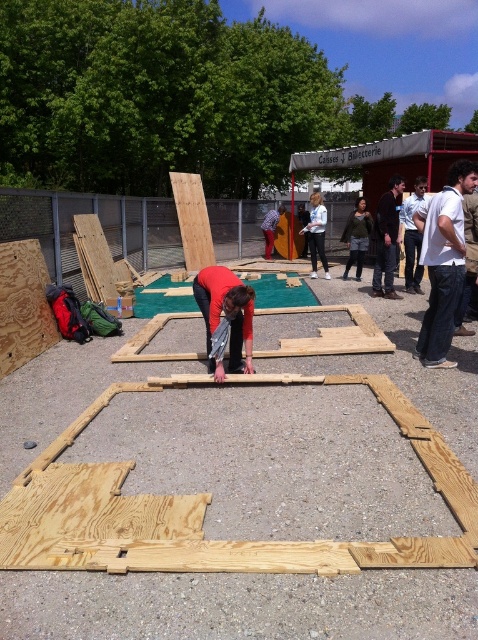
You are standing at the origin point of the coordinate system. The natural wood frame at center is located at coordinates 0.789, 0.435. If you want to walk directly towards it, which direction should you head?

The natural wood frame at center is located at coordinates (207, 504), so you should head northeast since the x and y coordinates are both positive and greater than 0.5, indicating a direction towards the upper right quadrant.

You are standing in the outdoor construction area and want to know which of the two points, point (387,212) or point (410,288), is closer to you. Can you determine this based on your current position?

Point (387,212) is closer to the viewer than point (410,288), so the closer point is point (387,212).